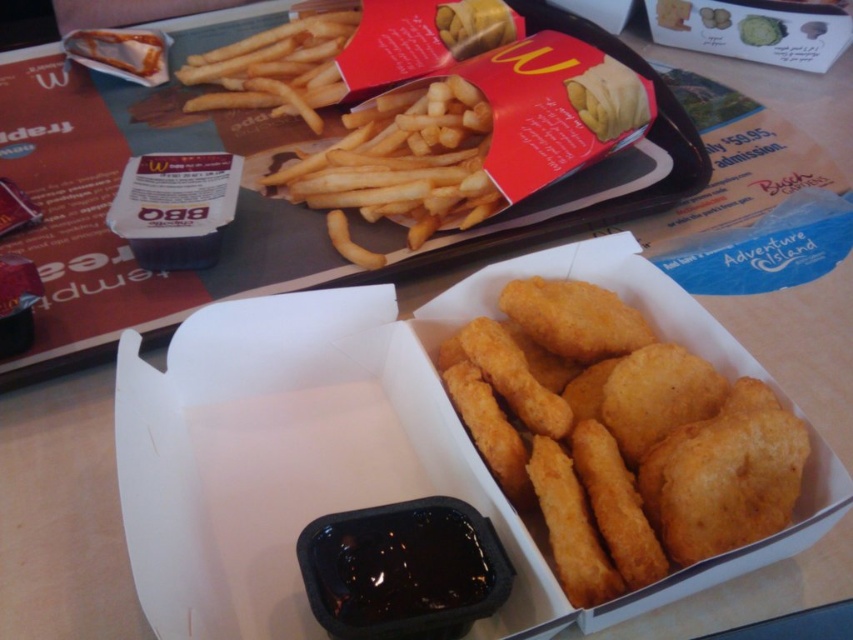
Question: Does golden fried nuggets at center have a greater width compared to golden crispy french fries at upper center?

Choices:
 (A) no
 (B) yes

Answer: (A)

Question: Which object is closer to the camera taking this photo?

Choices:
 (A) golden crispy fries at upper center
 (B) golden fried nuggets at center

Answer: (B)

Question: Which is nearer to the golden crispy fries at upper center?

Choices:
 (A) golden crispy french fries at upper center
 (B) golden fried nuggets at center

Answer: (A)

Question: Can you confirm if golden fried nuggets at center is positioned below golden crispy french fries at upper center?

Choices:
 (A) yes
 (B) no

Answer: (A)

Question: Is golden fried nuggets at center to the right of golden crispy fries at upper center from the viewer's perspective?

Choices:
 (A) no
 (B) yes

Answer: (B)

Question: Which point is farther to the camera?

Choices:
 (A) (466, 152)
 (B) (596, 570)
 (C) (321, 36)

Answer: (C)